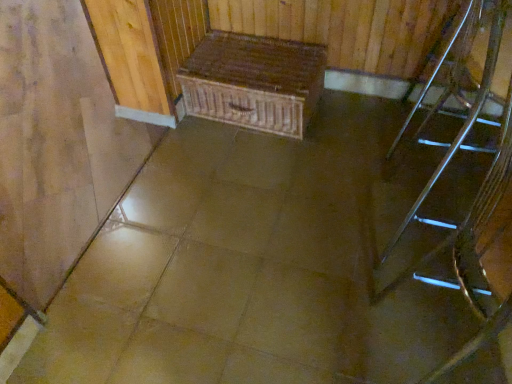
I want to click on blank space to the left of metallic silver chair at right, so click(358, 148).